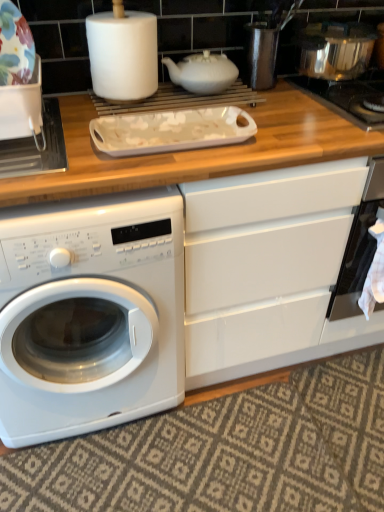
Question: From the image's perspective, relative to shiny metallic pot at upper right, which ranks as the first appliance in right-to-left order, is white matte paper towel at upper center above or below?

Choices:
 (A) below
 (B) above

Answer: (A)

Question: Based on their sizes in the image, would you say white matte paper towel at upper center is bigger or smaller than shiny metallic pot at upper right, the first appliance viewed from the top?

Choices:
 (A) big
 (B) small

Answer: (B)

Question: Which is farther from the white matte teapot at upper center?

Choices:
 (A) stainless steel gas stove at upper right
 (B) white glossy washing machine at lower left
 (C) white matte paper towel at upper center
 (D) black glass oven at right
 (E) shiny metallic pot at upper right, the second appliance in the left-to-right sequence

Answer: (B)

Question: Based on their relative distances, which object is farther from the stainless steel gas stove at upper right?

Choices:
 (A) shiny metallic pot at upper right, which ranks as the first appliance in right-to-left order
 (B) white matte paper towel at upper center
 (C) white matte teapot at upper center
 (D) black glass oven at right
 (E) porcelain floral plate at upper left, the second appliance in the right-to-left sequence

Answer: (E)